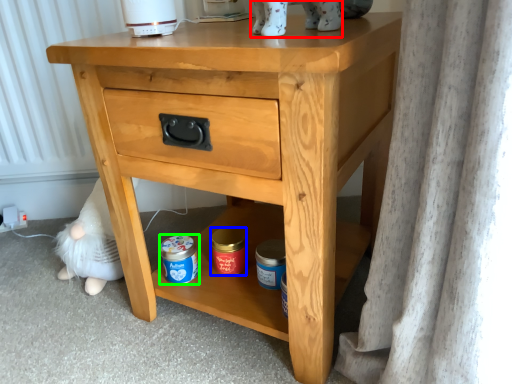
Question: Estimate the real-world distances between objects in this image. Which object is closer to animal (highlighted by a red box), pottery (highlighted by a blue box) or glass jar (highlighted by a green box)?

Choices:
 (A) pottery
 (B) glass jar

Answer: (A)